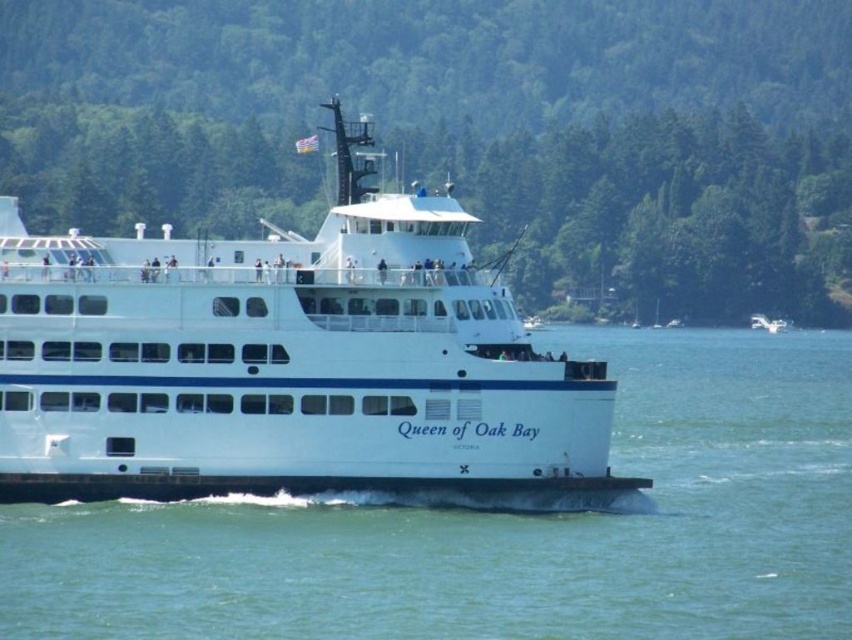
Question: Considering the relative positions of clear blue water at center and white glossy cruise ship at center in the image provided, where is clear blue water at center located with respect to white glossy cruise ship at center?

Choices:
 (A) above
 (B) below

Answer: (B)

Question: Does green leafy trees at center have a larger size compared to clear blue water at center?

Choices:
 (A) yes
 (B) no

Answer: (A)

Question: Based on their relative distances, which object is nearer to the clear blue water at center?

Choices:
 (A) white glossy cruise ship at center
 (B) white matte ferry at center

Answer: (A)

Question: Can you confirm if green leafy trees at center is thinner than white glossy cruise ship at center?

Choices:
 (A) no
 (B) yes

Answer: (A)

Question: Which of these objects is positioned farthest from the green leafy trees at center?

Choices:
 (A) clear blue water at center
 (B) white matte ferry at center

Answer: (A)

Question: Which point is closer to the camera?

Choices:
 (A) clear blue water at center
 (B) green leafy trees at center

Answer: (A)